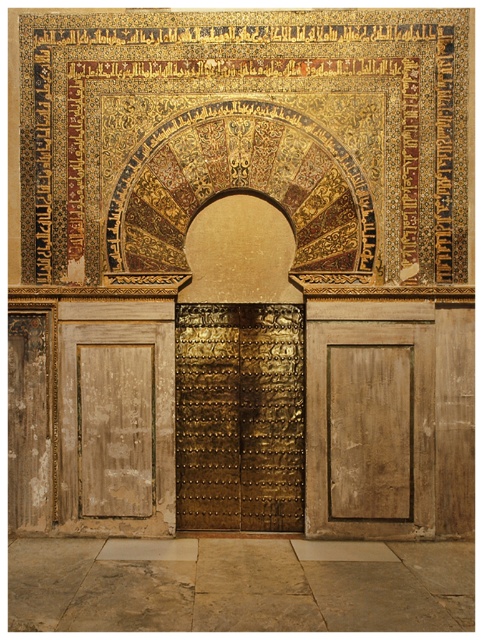
Identify the location of gold textured door at center. The image size is (483, 640). (240, 417).

Between gold textured door at center and wooden panel at left, which one appears on the left side from the viewer's perspective?

Positioned to the left is wooden panel at left.

Which is behind, point (283, 500) or point (121, 356)?

The point (283, 500) is behind.

Where is `gold textured door at center`? The image size is (483, 640). gold textured door at center is located at coordinates (240, 417).

Is gold mosaic at upper center closer to the viewer compared to gold textured archway at center?

That is False.

Can you confirm if gold mosaic at upper center is positioned below gold textured archway at center?

Incorrect, gold mosaic at upper center is not positioned below gold textured archway at center.

Where is `gold mosaic at upper center`? The image size is (483, 640). gold mosaic at upper center is located at coordinates (x=244, y=132).

Where is `gold mosaic at upper center`? The image size is (483, 640). gold mosaic at upper center is located at coordinates (244, 132).

This screenshot has width=483, height=640. Describe the element at coordinates (242, 188) in the screenshot. I see `gold textured archway at center` at that location.

Where is `gold textured archway at center`? Image resolution: width=483 pixels, height=640 pixels. gold textured archway at center is located at coordinates (242, 188).

Which is behind, point (340, 221) or point (298, 456)?

Point (298, 456)

The image size is (483, 640). I want to click on gold textured archway at center, so click(x=242, y=188).